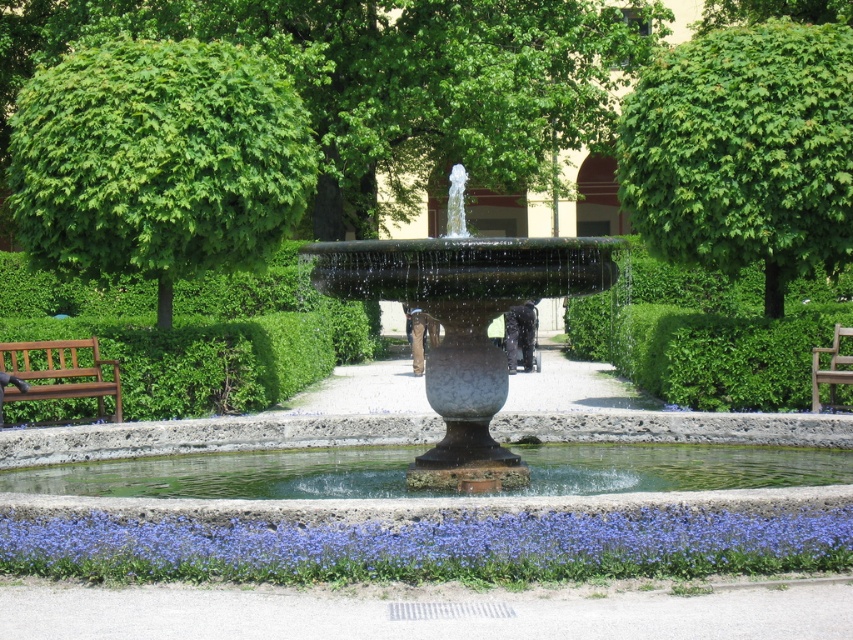
You are standing at the point labeled point (x=746, y=138) in the garden scene. You want to walk towards the fountain located at the center of the image. Will you pass by the point labeled point (x=402, y=579) along your path?

Yes, since point (x=402, y=579) is in front of point (x=746, y=138), walking towards the fountain at the center would require passing through point (x=402, y=579).

You are standing in the garden and want to take a photo of both the green leafy tree at upper left and the green leafy tree at upper center. Which tree should you back away from to ensure both are fully in the frame?

You should back away from the green leafy tree at upper left because it is larger in size compared to the green leafy tree at upper center, so you need more space to capture it fully in the photo.

Consider the image. You are planning to place a new potted plant between the brown wooden bench at left and the wooden bench at center. Based on their positions, which bench should the plant be closer to?

The brown wooden bench at left is positioned over the wooden bench at center, so the plant should be placed closer to the wooden bench at center to avoid blocking the view from the upper bench.